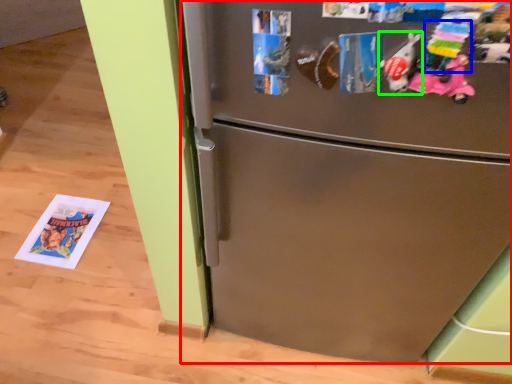
Question: Which object is positioned farthest from refrigerator (highlighted by a red box)? Select from toy (highlighted by a blue box) and toy (highlighted by a green box).

Choices:
 (A) toy
 (B) toy

Answer: (A)